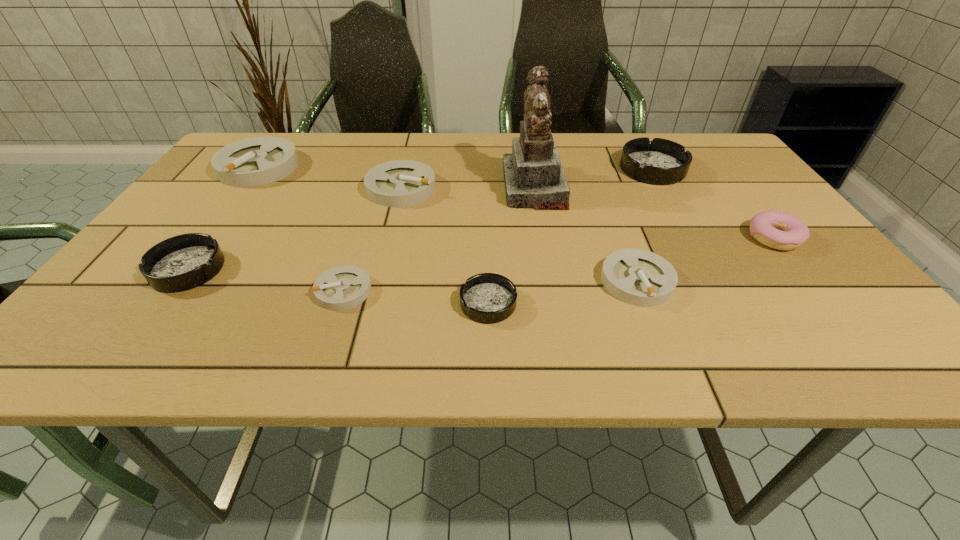
Locate an element on the screen. the tallest object is located at coordinates (534, 177).

The height and width of the screenshot is (540, 960). In order to click on the biggest gray ashtray in this screenshot , I will do `click(257, 161)`.

Where is `the rightmost dark ashtray`? the rightmost dark ashtray is located at coordinates (658, 162).

This screenshot has width=960, height=540. I want to click on the biggest dark ashtray, so click(658, 162).

This screenshot has width=960, height=540. I want to click on the third smallest gray ashtray, so click(400, 183).

The image size is (960, 540). What are the coordinates of `doughnut` in the screenshot? It's located at (778, 230).

Find the location of `pink doughnut`. pink doughnut is located at coordinates (778, 230).

Identify the location of the leftmost dark ashtray. This screenshot has height=540, width=960. (183, 262).

Find the location of a particular element. the rightmost gray ashtray is located at coordinates (638, 277).

Image resolution: width=960 pixels, height=540 pixels. Identify the location of the fifth ashtray from left to right. (488, 298).